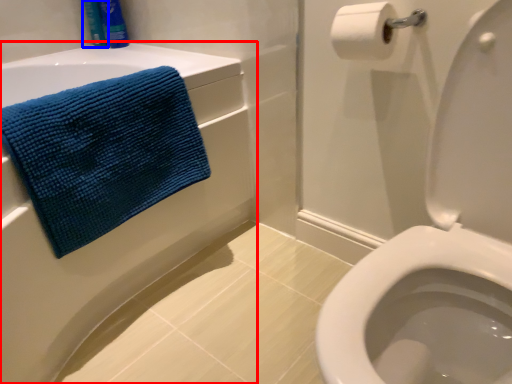
Question: Which object appears closest to the camera in this image, bath (highlighted by a red box) or toiletry (highlighted by a blue box)?

Choices:
 (A) bath
 (B) toiletry

Answer: (A)